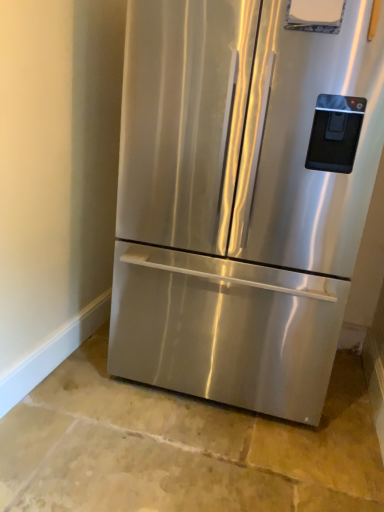
Measure the distance between point (311,5) and camera.

Point (311,5) and camera are 4.15 feet apart from each other.

The width and height of the screenshot is (384, 512). What do you see at coordinates (241, 198) in the screenshot?
I see `stainless steel refrigerator at center` at bounding box center [241, 198].

You are a GUI agent. You are given a task and a screenshot of the screen. Output one action in this format:
    pyautogui.click(x=<x>, y=<y>)
    Task: Click on the stainless steel refrigerator at center
    This screenshot has width=384, height=512.
    Given the screenshot: What is the action you would take?
    pyautogui.click(x=241, y=198)

Locate an element on the screen. This screenshot has width=384, height=512. stainless steel refrigerator at center is located at coordinates (241, 198).